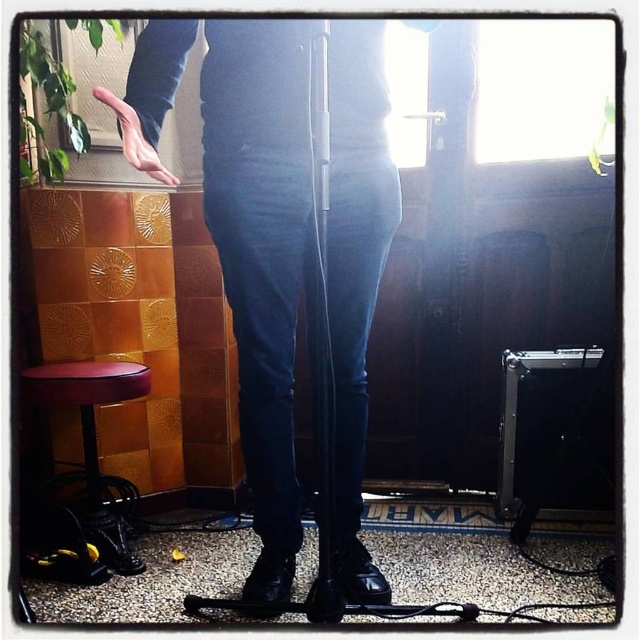
Between transparent plastic microphone at center and matte skin hand at center, which one appears on the left side from the viewer's perspective?

matte skin hand at center is more to the left.

Is transparent plastic microphone at center to the left of matte skin hand at center from the viewer's perspective?

In fact, transparent plastic microphone at center is to the right of matte skin hand at center.

Does point (324, 138) lie behind point (115, 97)?

Yes, point (324, 138) is behind point (115, 97).

The height and width of the screenshot is (640, 640). Find the location of `transparent plastic microphone at center`. transparent plastic microphone at center is located at coordinates (320, 116).

Between leather bar stool at lower left and transparent plastic microphone at center, which one appears on the left side from the viewer's perspective?

leather bar stool at lower left is more to the left.

Does leather bar stool at lower left appear under transparent plastic microphone at center?

Correct, leather bar stool at lower left is located below transparent plastic microphone at center.

Is point (88, 492) positioned before point (310, 52)?

That is False.

Where is `leather bar stool at lower left`? This screenshot has width=640, height=640. leather bar stool at lower left is located at coordinates (93, 445).

Who is shorter, leather bar stool at lower left or matte skin hand at center?

matte skin hand at center

From the picture: Who is lower down, leather bar stool at lower left or matte skin hand at center?

leather bar stool at lower left is below.

Does point (113, 502) come closer to viewer compared to point (122, 129)?

No.

This screenshot has height=640, width=640. I want to click on leather bar stool at lower left, so click(93, 445).